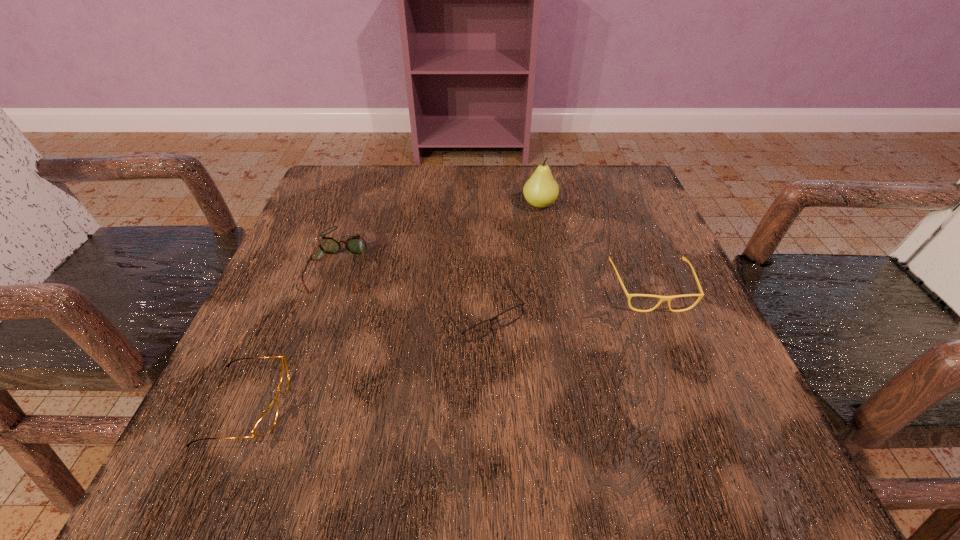
This screenshot has height=540, width=960. Find the location of `object present at the near edge`. object present at the near edge is located at coordinates (266, 422).

Find the location of `object positioned at the right edge`. object positioned at the right edge is located at coordinates (662, 298).

What are the coordinates of `object at the near left corner` in the screenshot? It's located at (266, 422).

At what (x,y) coordinates should I click in order to perform the action: click on vacant space at the far edge of the desktop. Please return your answer as a coordinate pair (x, y). Looking at the image, I should click on (420, 178).

At what (x,y) coordinates should I click in order to perform the action: click on vacant region at the near edge of the desktop. Please return your answer as a coordinate pair (x, y). The width and height of the screenshot is (960, 540). Looking at the image, I should click on pos(500,450).

The height and width of the screenshot is (540, 960). Identify the location of vacant point at the left edge. (357, 271).

You are a GUI agent. You are given a task and a screenshot of the screen. Output one action in this format:
    pyautogui.click(x=<x>, y=<y>)
    Task: Click on the free space at the right edge of the desktop
    The height and width of the screenshot is (540, 960).
    Given the screenshot: What is the action you would take?
    pyautogui.click(x=697, y=401)

What are the coordinates of `vacant space at the far left corner of the desktop` in the screenshot? It's located at (379, 198).

Locate an element on the screen. The height and width of the screenshot is (540, 960). vacant region at the near left corner of the desktop is located at coordinates (311, 446).

Image resolution: width=960 pixels, height=540 pixels. What are the coordinates of `vacant space at the far right corner` in the screenshot? It's located at (574, 194).